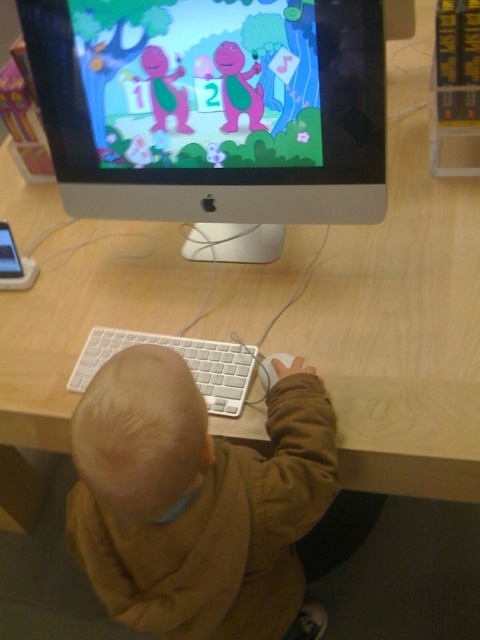
Question: Which object is farther from the camera taking this photo?

Choices:
 (A) white plastic mouse at center
 (B) brown cotton hoodie at lower center

Answer: (A)

Question: Among these objects, which one is farthest from the camera?

Choices:
 (A) brown cotton hoodie at lower center
 (B) white plastic monitor at upper center
 (C) white plastic mouse at center
 (D) white plastic keyboard at center

Answer: (D)

Question: Is white plastic monitor at upper center to the right of brown cotton hoodie at lower center from the viewer's perspective?

Choices:
 (A) no
 (B) yes

Answer: (A)

Question: Which of the following is the farthest from the observer?

Choices:
 (A) brown cotton hoodie at lower center
 (B) white plastic keyboard at center

Answer: (B)

Question: Is brown cotton hoodie at lower center bigger than white plastic keyboard at center?

Choices:
 (A) no
 (B) yes

Answer: (B)

Question: Is brown cotton hoodie at lower center bigger than white plastic mouse at center?

Choices:
 (A) no
 (B) yes

Answer: (B)